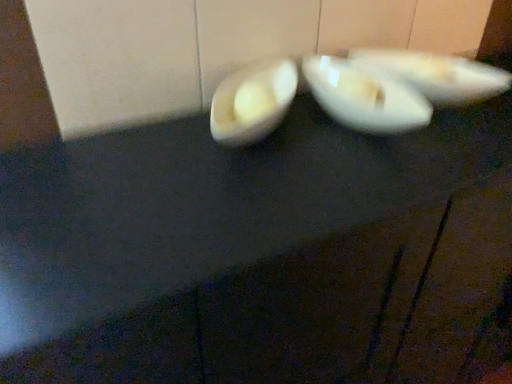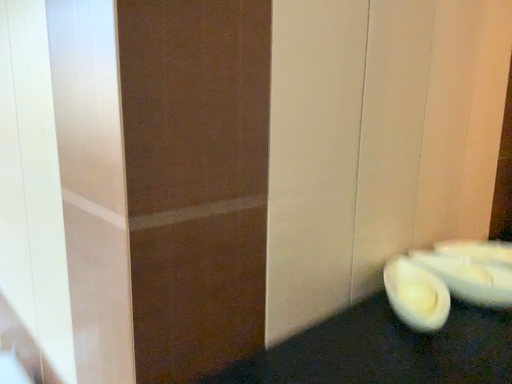
Question: How did the camera likely rotate when shooting the video?

Choices:
 (A) rotated right
 (B) rotated left

Answer: (A)